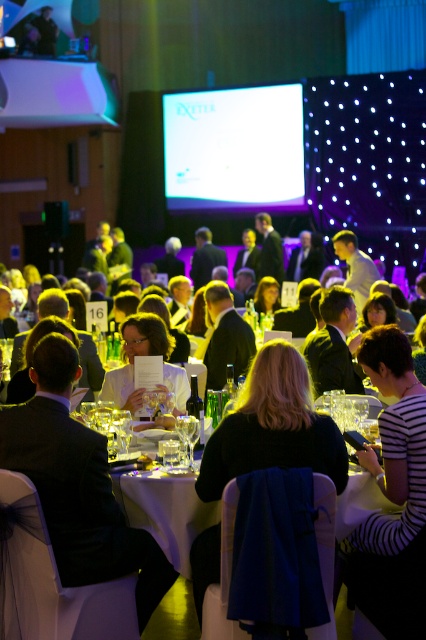
Who is higher up, white fabric chair at center or black matte jacket at center?

black matte jacket at center is higher up.

Does white fabric chair at center appear on the right side of black matte jacket at center?

Incorrect, white fabric chair at center is not on the right side of black matte jacket at center.

Who is more distant from viewer, (x=80, y=486) or (x=233, y=442)?

Positioned behind is point (x=80, y=486).

Where is `white fabric chair at center`? This screenshot has height=640, width=426. white fabric chair at center is located at coordinates (77, 484).

Which is behind, point (141, 541) or point (144, 348)?

The point (144, 348) is more distant.

The width and height of the screenshot is (426, 640). Find the location of `white fabric chair at center`. white fabric chair at center is located at coordinates (77, 484).

Where is `white fabric chair at center`? The height and width of the screenshot is (640, 426). white fabric chair at center is located at coordinates (77, 484).

Can you confirm if black matte jacket at center is positioned below white glossy shirt at center?

Indeed, black matte jacket at center is positioned under white glossy shirt at center.

The image size is (426, 640). Describe the element at coordinates (273, 426) in the screenshot. I see `black matte jacket at center` at that location.

Measure the distance between point [201,563] and camera.

Point [201,563] and camera are 2.84 meters apart from each other.

Where is `black matte jacket at center`? black matte jacket at center is located at coordinates (273, 426).